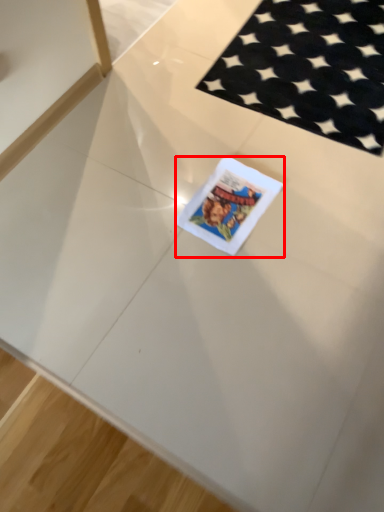
Question: Considering the relative positions of birthday card (annotated by the red box) and mat in the image provided, where is birthday card (annotated by the red box) located with respect to the staircase?

Choices:
 (A) left
 (B) right

Answer: (A)